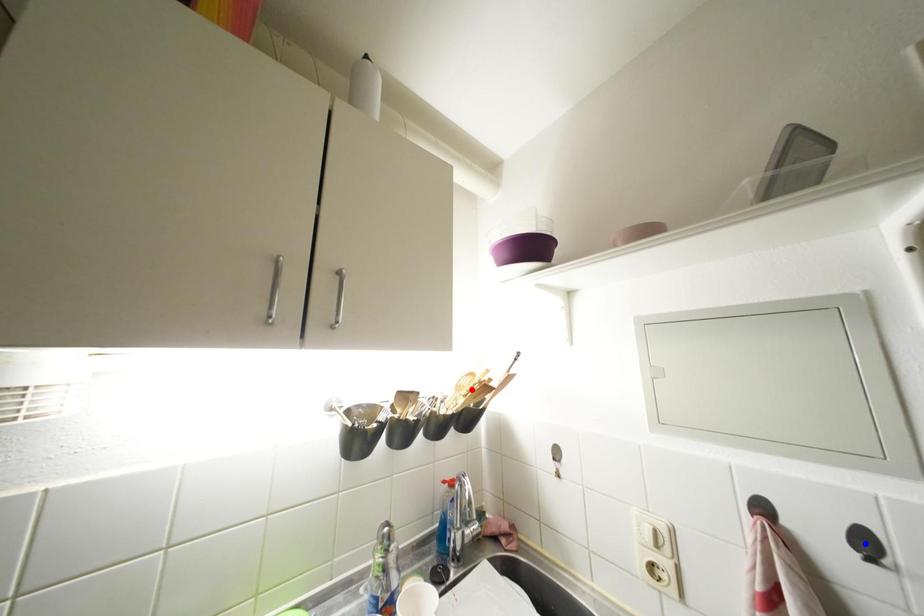
Question: Two points are marked on the image. Which point is closer to the camera?

Choices:
 (A) Blue point is closer.
 (B) Red point is closer.

Answer: (A)